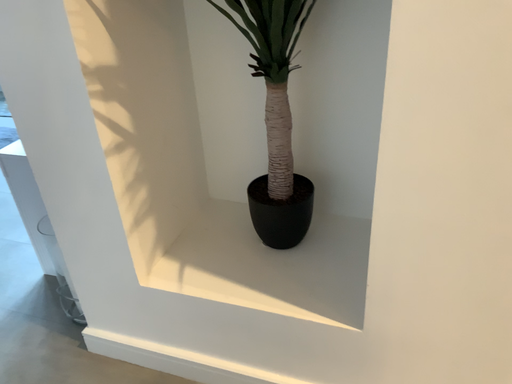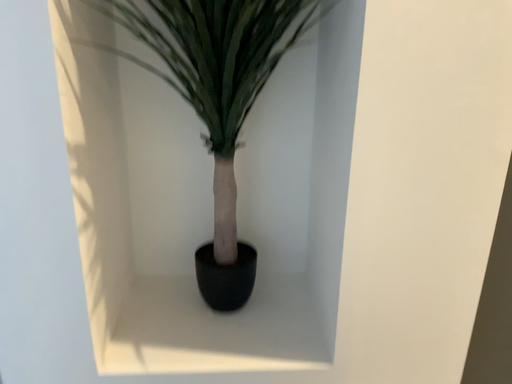
Question: Which way did the camera rotate in the video?

Choices:
 (A) rotated upward
 (B) rotated downward

Answer: (A)